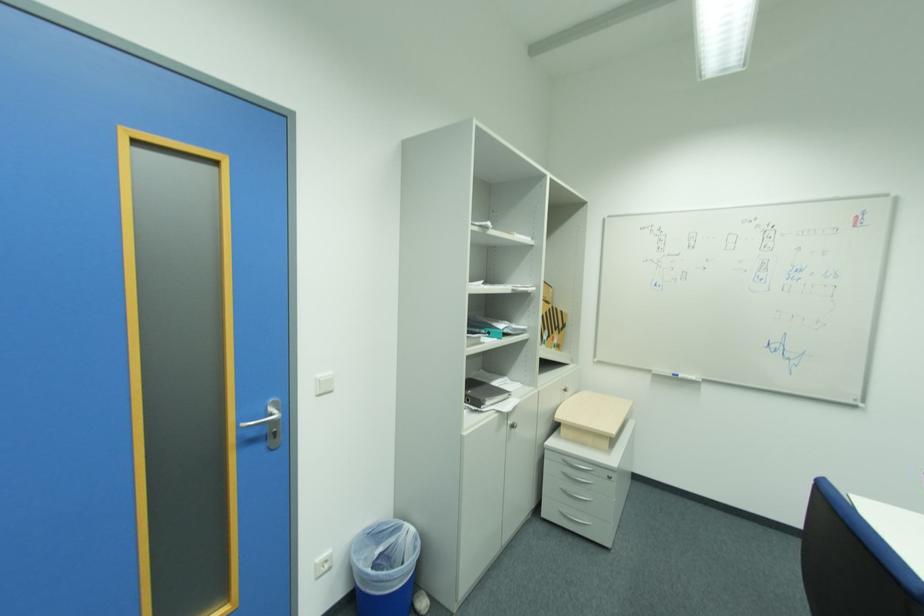
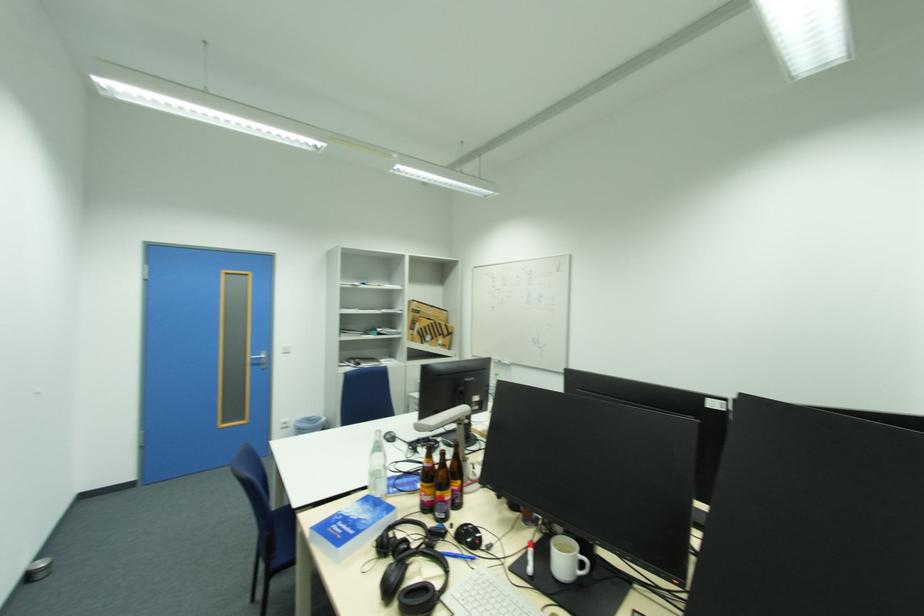
Find the pixel in the second image that matches point (323, 377) in the first image.

(289, 347)